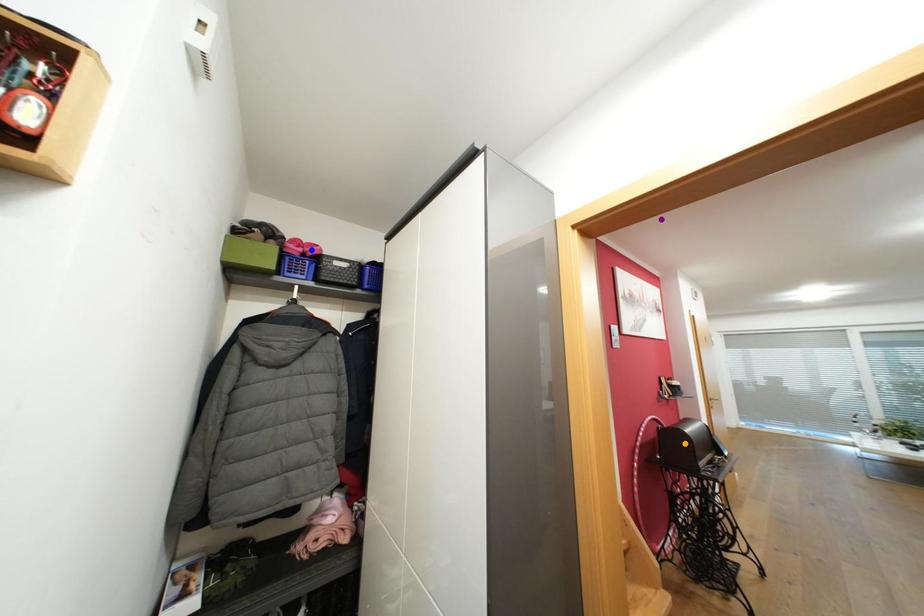
Order these from nearest to farthest:
A) purple point
B) orange point
C) blue point

1. purple point
2. blue point
3. orange point